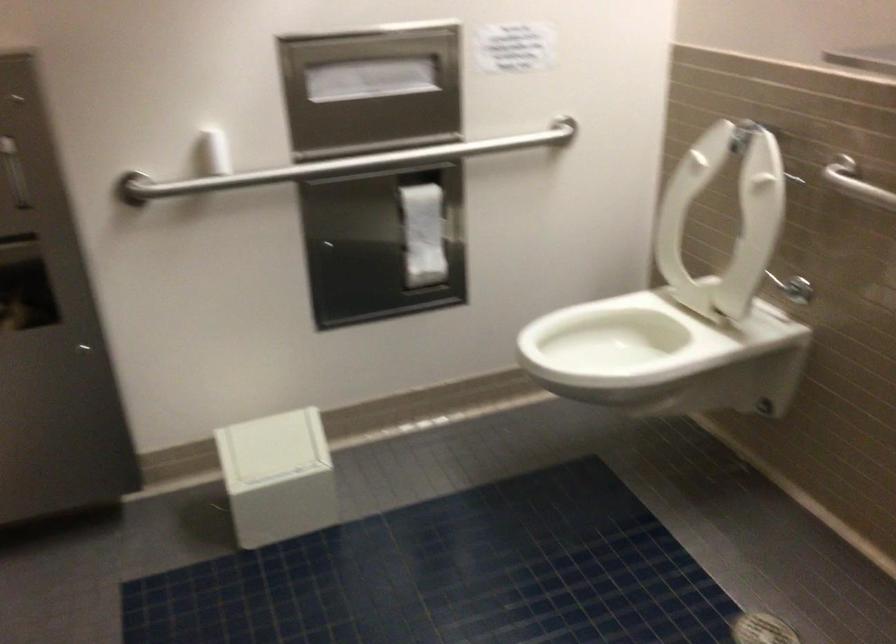
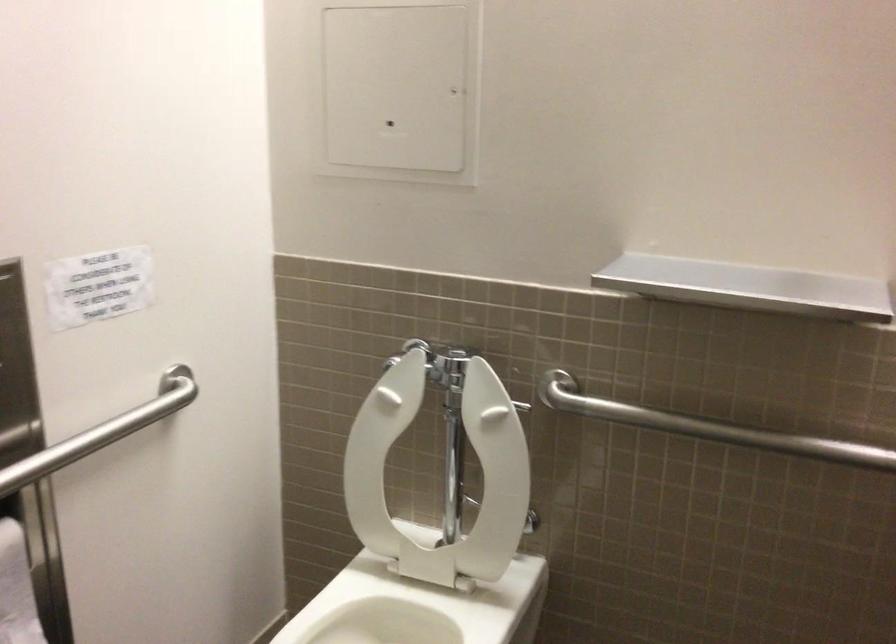
Where in the second image is the point corresponding to (485,138) from the first image?

(102, 431)